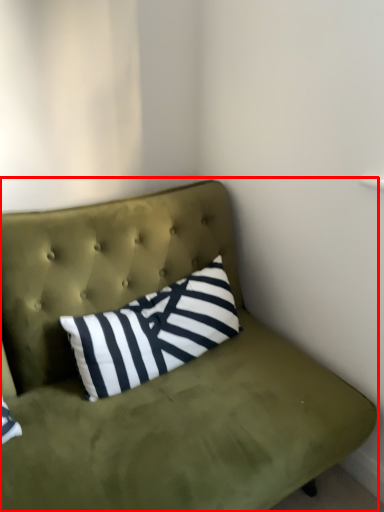
Question: Where is studio couch (annotated by the red box) located in relation to pillow in the image?

Choices:
 (A) right
 (B) left

Answer: (B)